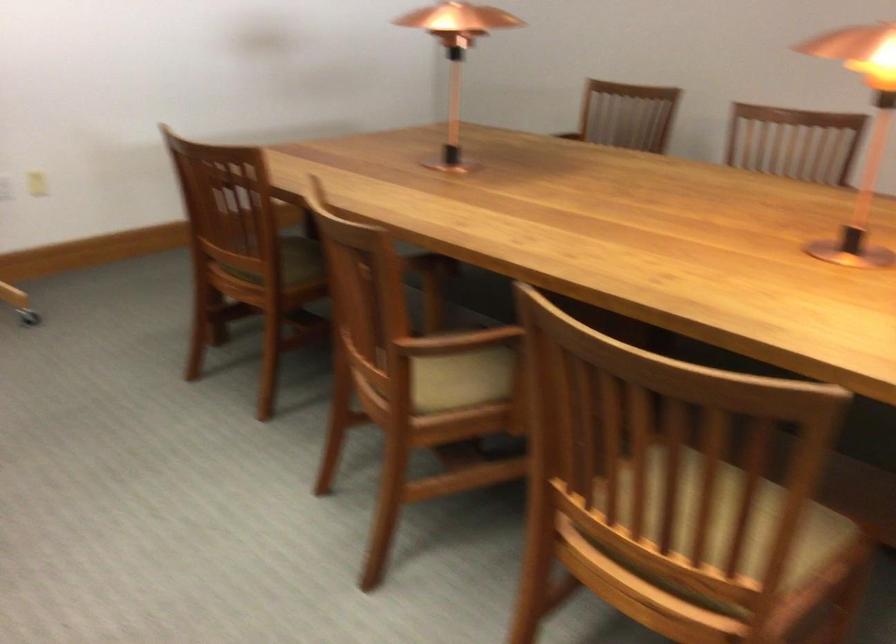
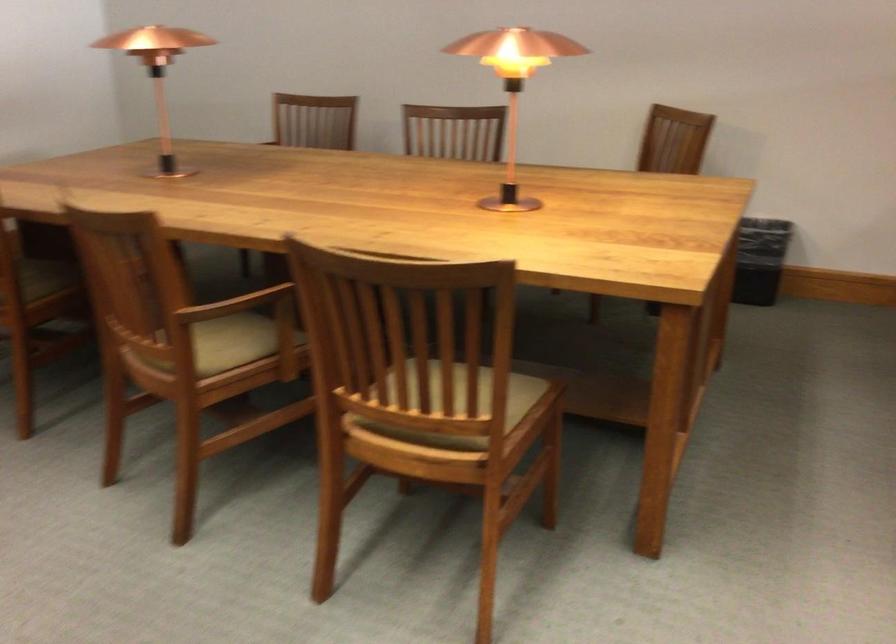
In the second image, find the point that corresponds to [860,131] in the first image.

(502, 120)